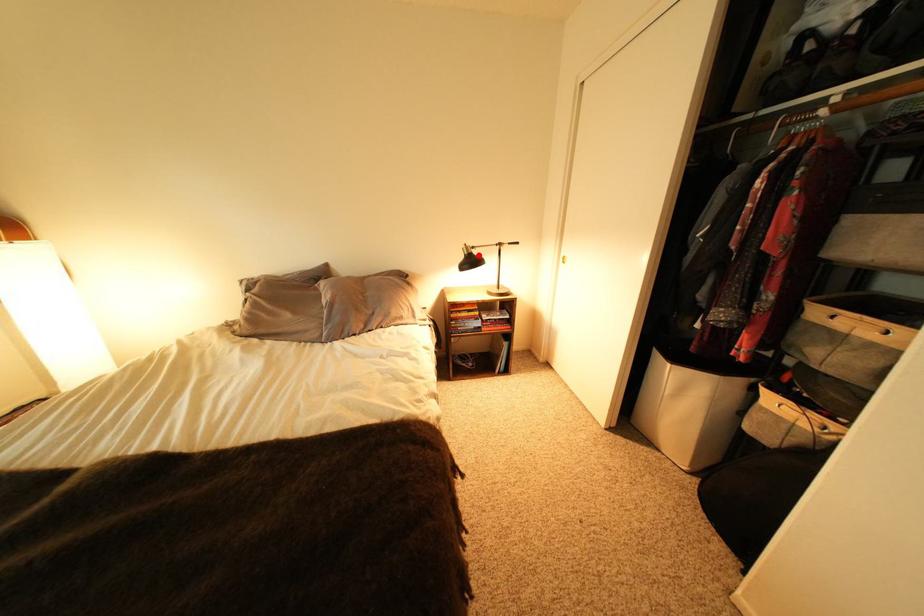
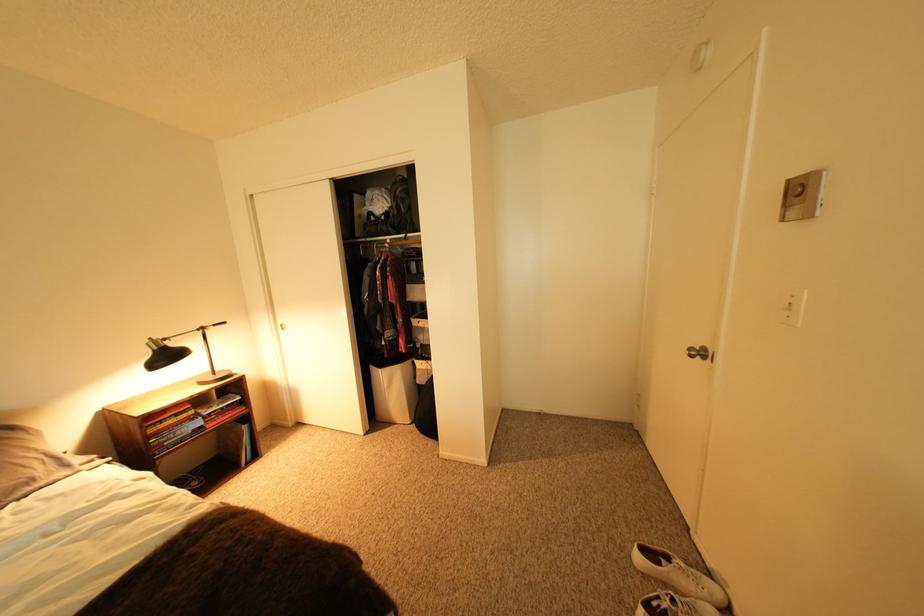
Where in the second image is the point corresponding to the highlighted location from the first image?

(168, 350)